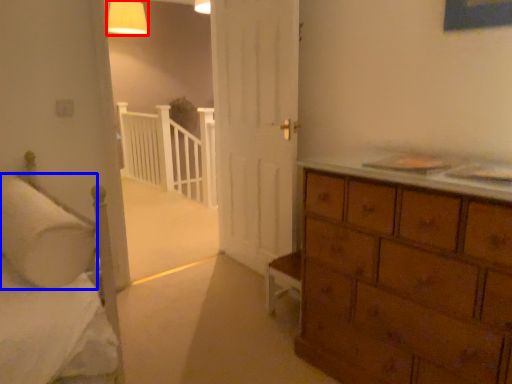
Question: Which of the following is the closest to the observer, lighting (highlighted by a red box) or pillow (highlighted by a blue box)?

Choices:
 (A) lighting
 (B) pillow

Answer: (B)